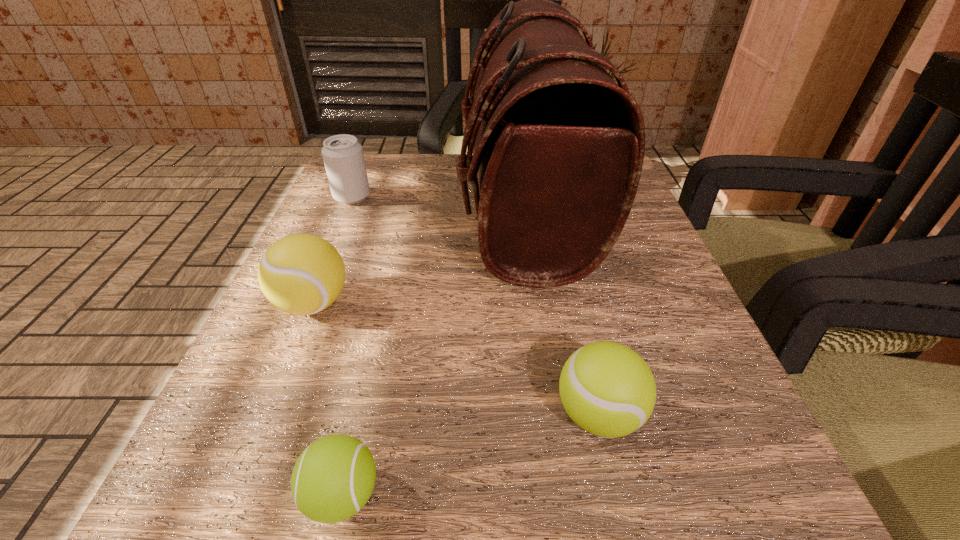
Image resolution: width=960 pixels, height=540 pixels. I want to click on free space between the farthest tennis ball and the tallest object, so click(x=419, y=256).

Locate an element on the screen. free spot between the can and the tallest object is located at coordinates (439, 202).

Locate an element on the screen. empty space that is in between the tallest object and the can is located at coordinates (439, 202).

At what (x,y) coordinates should I click in order to perform the action: click on empty location between the leftmost tennis ball and the third object from right to left. Please return your answer as a coordinate pair (x, y). The height and width of the screenshot is (540, 960). Looking at the image, I should click on (327, 399).

At what (x,y) coordinates should I click in order to perform the action: click on free space between the tallest object and the leftmost tennis ball. Please return your answer as a coordinate pair (x, y). Looking at the image, I should click on (419, 256).

Identify the location of vacant point located between the can and the tallest object. The image size is (960, 540). (439, 202).

The height and width of the screenshot is (540, 960). In order to click on vacant space in between the can and the second tennis ball from left to right in this screenshot , I will do `click(348, 346)`.

I want to click on the third closest object to the satchel, so click(x=343, y=157).

The width and height of the screenshot is (960, 540). Find the location of `object that is the third nearest to the tallest object`. object that is the third nearest to the tallest object is located at coordinates (343, 157).

Locate an element on the screen. Image resolution: width=960 pixels, height=540 pixels. the second closest tennis ball relative to the shortest object is located at coordinates (607, 389).